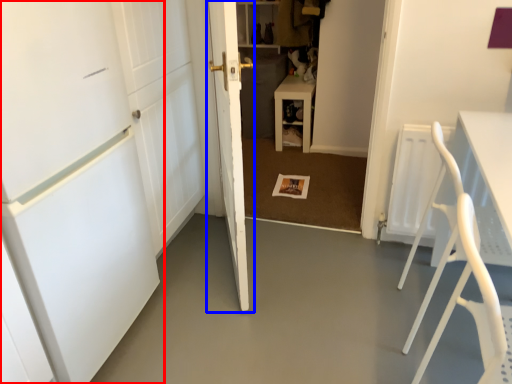
Question: Among these objects, which one is farthest to the camera, door (highlighted by a red box) or door (highlighted by a blue box)?

Choices:
 (A) door
 (B) door

Answer: (B)